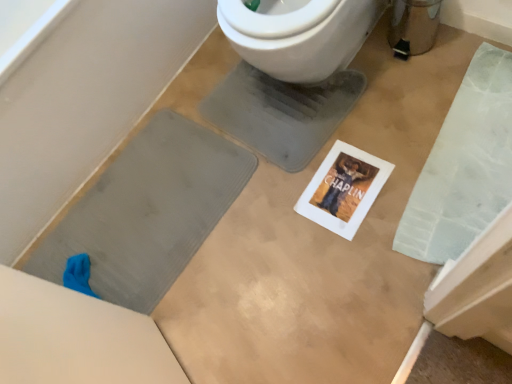
The height and width of the screenshot is (384, 512). I want to click on gray rubber bath mat at left, so click(148, 212).

What do you see at coordinates (148, 212) in the screenshot? I see `gray rubber bath mat at left` at bounding box center [148, 212].

At what (x,y) coordinates should I click in order to perform the action: click on gray rubber bath mat at left. Please return your answer as a coordinate pair (x, y). Looking at the image, I should click on (148, 212).